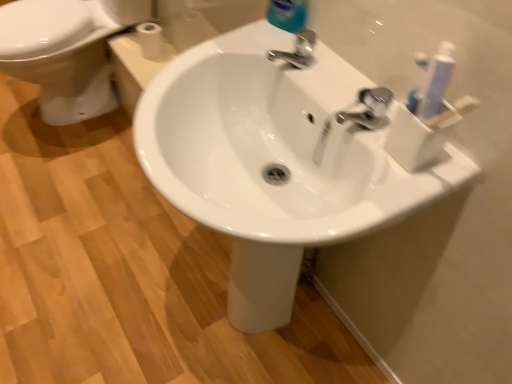
Question: Would you consider blue glossy bottle at upper center to be distant from white glossy sink at center?

Choices:
 (A) no
 (B) yes

Answer: (A)

Question: Does blue glossy bottle at upper center have a greater height compared to white glossy sink at center?

Choices:
 (A) yes
 (B) no

Answer: (B)

Question: Is blue glossy bottle at upper center thinner than white glossy sink at center?

Choices:
 (A) yes
 (B) no

Answer: (A)

Question: Considering the relative sizes of blue glossy bottle at upper center and white glossy sink at center in the image provided, is blue glossy bottle at upper center shorter than white glossy sink at center?

Choices:
 (A) no
 (B) yes

Answer: (B)

Question: From a real-world perspective, is blue glossy bottle at upper center below white glossy sink at center?

Choices:
 (A) yes
 (B) no

Answer: (B)

Question: In terms of size, does polished chrome faucet at upper right, positioned as the first tap in bottom-to-top order, appear bigger or smaller than white glossy bidet at left?

Choices:
 (A) small
 (B) big

Answer: (A)

Question: In the image, is polished chrome faucet at upper right, acting as the 1th tap starting from the front, positioned in front of or behind white glossy bidet at left?

Choices:
 (A) front
 (B) behind

Answer: (A)

Question: From a real-world perspective, is polished chrome faucet at upper right, acting as the 1th tap starting from the front, physically located above or below white glossy bidet at left?

Choices:
 (A) below
 (B) above

Answer: (B)

Question: In terms of height, does polished chrome faucet at upper right, which is the 2th tap from left to right, look taller or shorter compared to white glossy bidet at left?

Choices:
 (A) tall
 (B) short

Answer: (B)

Question: Is white matte toilet paper at upper left in front of or behind silver metallic faucet at upper center, positioned as the 1th tap in top-to-bottom order, in the image?

Choices:
 (A) behind
 (B) front

Answer: (A)

Question: Would you say white matte toilet paper at upper left is to the left or to the right of silver metallic faucet at upper center, positioned as the 1th tap in top-to-bottom order, in the picture?

Choices:
 (A) right
 (B) left

Answer: (B)

Question: Which is correct: white matte toilet paper at upper left is inside silver metallic faucet at upper center, the 2th tap in the right-to-left sequence, or outside of it?

Choices:
 (A) outside
 (B) inside

Answer: (A)

Question: Is point (143, 23) positioned closer to the camera than point (308, 36)?

Choices:
 (A) closer
 (B) farther

Answer: (B)

Question: Considering the positions of point (293, 21) and point (296, 61), is point (293, 21) closer or farther from the camera than point (296, 61)?

Choices:
 (A) farther
 (B) closer

Answer: (A)

Question: Looking at their shapes, would you say blue glossy bottle at upper center is wider or thinner than silver metallic faucet at upper center, the 2th tap in the right-to-left sequence?

Choices:
 (A) thin
 (B) wide

Answer: (A)